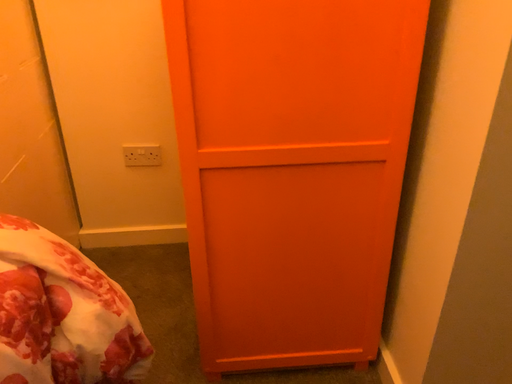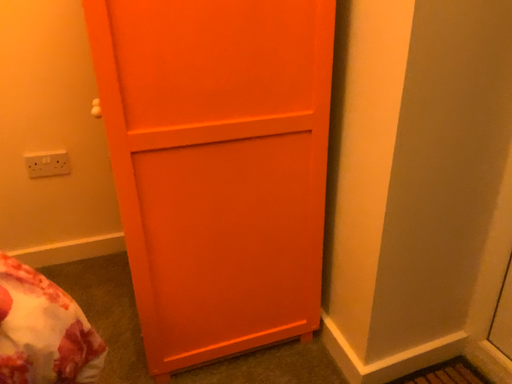
Question: Which way did the camera rotate in the video?

Choices:
 (A) rotated left
 (B) rotated right

Answer: (B)